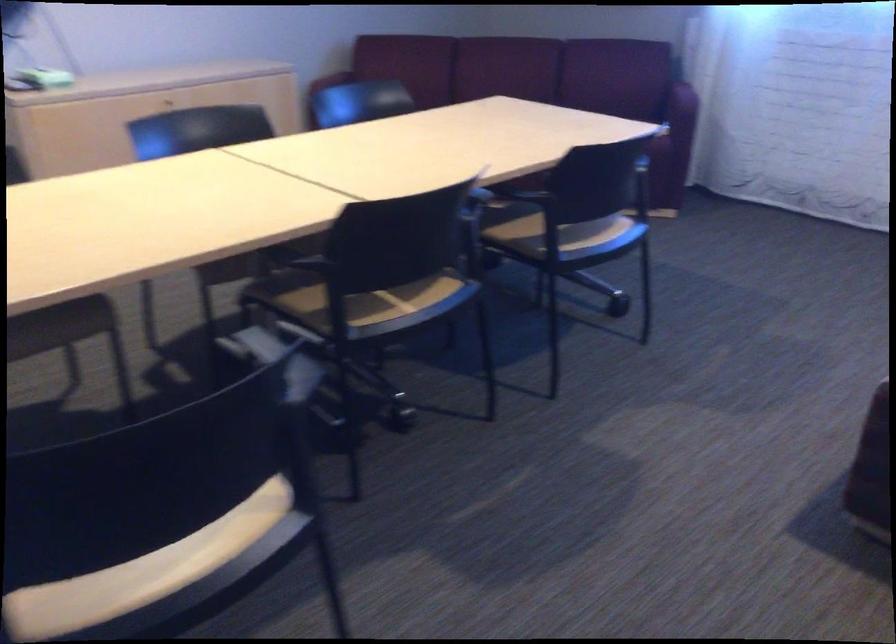
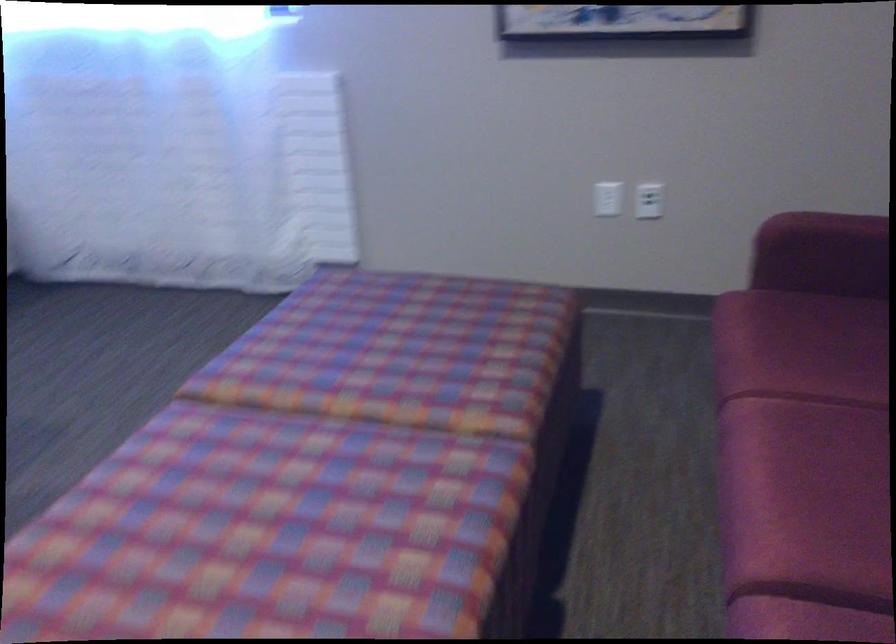
Which direction would the cameraman need to move to produce the second image?

The movement direction of the cameraman is right, forward.